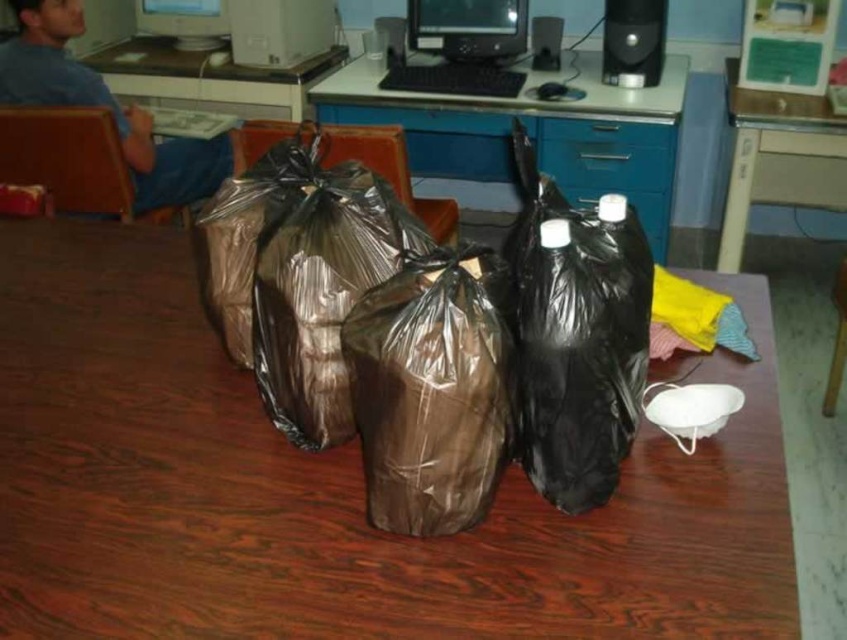
Question: Which object is positioned farthest from the blue denim jeans at left?

Choices:
 (A) matte plastic computer desk at upper right
 (B) matte plastic monitor at upper center

Answer: (A)

Question: Is brown plastic bags at center below matte plastic computer desk at upper center?

Choices:
 (A) no
 (B) yes

Answer: (B)

Question: Which object appears farthest from the camera in this image?

Choices:
 (A) matte plastic monitor at upper center
 (B) brown leather chair at center

Answer: (A)

Question: Can you confirm if blue denim jeans at left is positioned above matte plastic computer desk at upper center?

Choices:
 (A) yes
 (B) no

Answer: (B)

Question: Which of the following is the farthest from the observer?

Choices:
 (A) blue plastic computer desk at center
 (B) brown plastic bags at center
 (C) wooden chair at center
 (D) white plastic computer at upper center

Answer: (D)

Question: Can you confirm if brown leather chair at left is wider than matte plastic monitor at upper center?

Choices:
 (A) no
 (B) yes

Answer: (B)